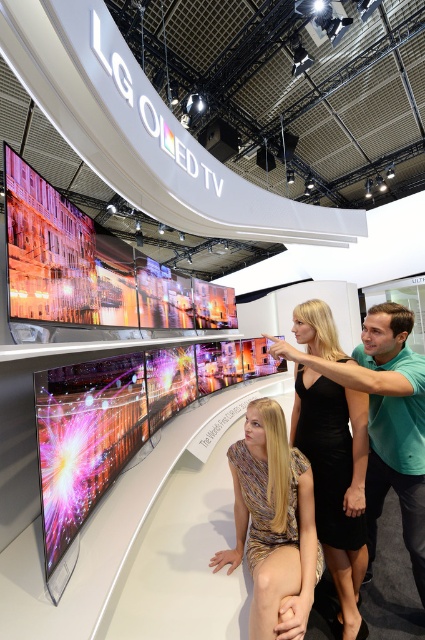
Question: Which point is farther to the camera?

Choices:
 (A) green matte shirt at center
 (B) metallic gold dress at center

Answer: (A)

Question: Which of the following is the closest to the observer?

Choices:
 (A) metallic gold dress at center
 (B) green matte shirt at center

Answer: (A)

Question: Is metallic gold dress at center further to the viewer compared to green matte shirt at center?

Choices:
 (A) no
 (B) yes

Answer: (A)

Question: Does metallic gold dress at center appear under green matte shirt at center?

Choices:
 (A) yes
 (B) no

Answer: (A)

Question: Among these points, which one is nearest to the camera?

Choices:
 (A) (370, 492)
 (B) (265, 417)

Answer: (B)

Question: Does metallic gold dress at center appear over green matte shirt at center?

Choices:
 (A) no
 (B) yes

Answer: (A)